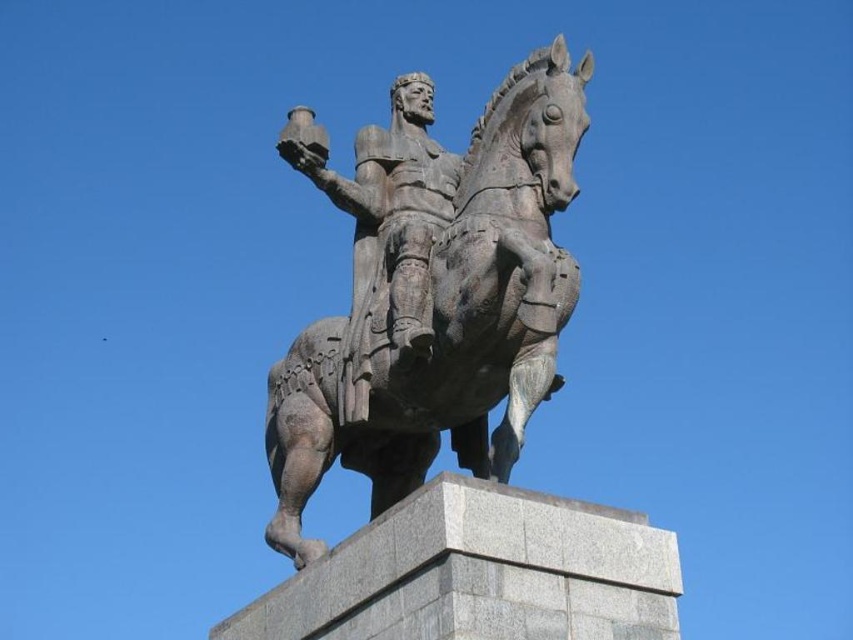
Who is taller, bronze statue at center or bronze armor at center?

With more height is bronze armor at center.

Is bronze statue at center wider than bronze armor at center?

Yes, bronze statue at center is wider than bronze armor at center.

Which is in front, point (490, 451) or point (403, 236)?

Positioned in front is point (403, 236).

Image resolution: width=853 pixels, height=640 pixels. Find the location of `bronze statue at center`. bronze statue at center is located at coordinates (434, 296).